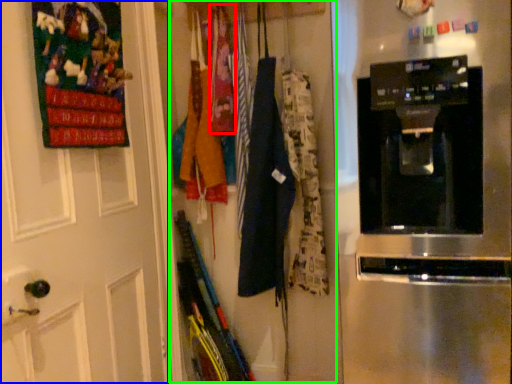
Question: Estimate the real-world distances between objects in this image. Which object is farther from clothing (highlighted by a red box), door (highlighted by a blue box) or closet (highlighted by a green box)?

Choices:
 (A) door
 (B) closet

Answer: (A)